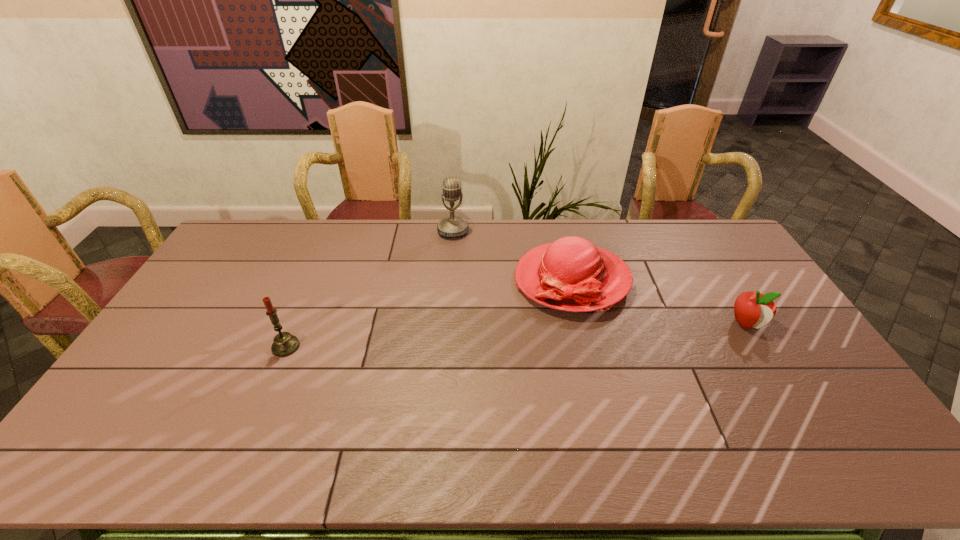
You are a GUI agent. You are given a task and a screenshot of the screen. Output one action in this format:
    pyautogui.click(x=<x>, y=<y>)
    Task: Click on the vacant position located at the front of the third tallest object with a bow
    The width and height of the screenshot is (960, 540).
    Given the screenshot: What is the action you would take?
    pyautogui.click(x=508, y=312)

This screenshot has height=540, width=960. I want to click on free space located at the front of the third tallest object with a bow, so click(x=490, y=321).

At what (x,y) coordinates should I click in order to perform the action: click on vacant space positioned 0.130m at the front of the third tallest object with a bow. Please return your answer as a coordinate pair (x, y). Looking at the image, I should click on (494, 319).

I want to click on blank space located 0.250m on the front-facing side of the tallest object, so click(x=457, y=284).

Locate an element on the screen. free space located on the front-facing side of the tallest object is located at coordinates (457, 286).

Identify the location of vacant space located on the front-facing side of the tallest object. This screenshot has height=540, width=960. (455, 262).

Locate an element on the screen. This screenshot has width=960, height=540. hat present at the far edge is located at coordinates (571, 274).

The width and height of the screenshot is (960, 540). Identify the location of microphone that is at the far edge. (452, 226).

Where is `object that is at the right edge`? This screenshot has width=960, height=540. object that is at the right edge is located at coordinates (752, 309).

Locate an element on the screen. vacant point at the far edge is located at coordinates (292, 225).